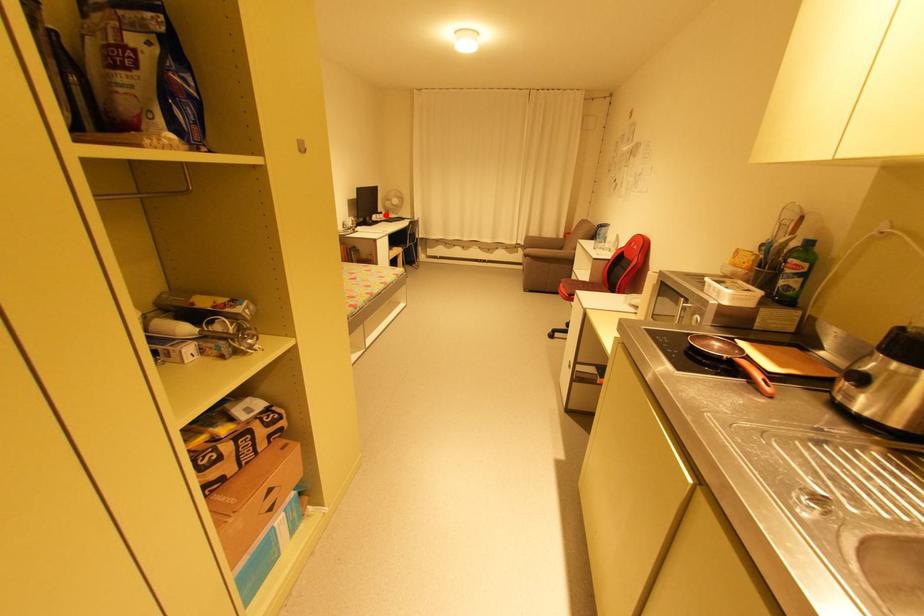
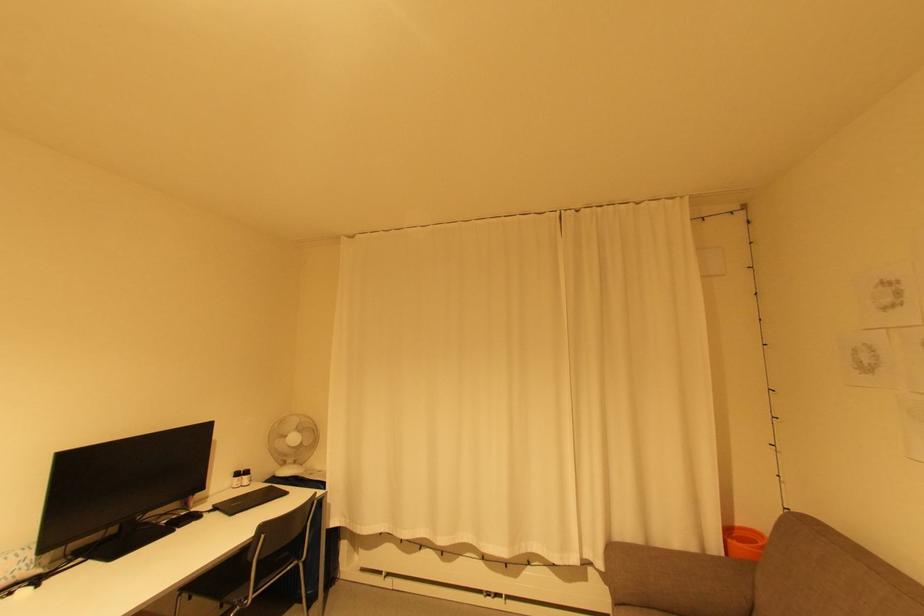
Locate, in the second image, the point that corresponds to the highlighted location in the first image.

(250, 477)